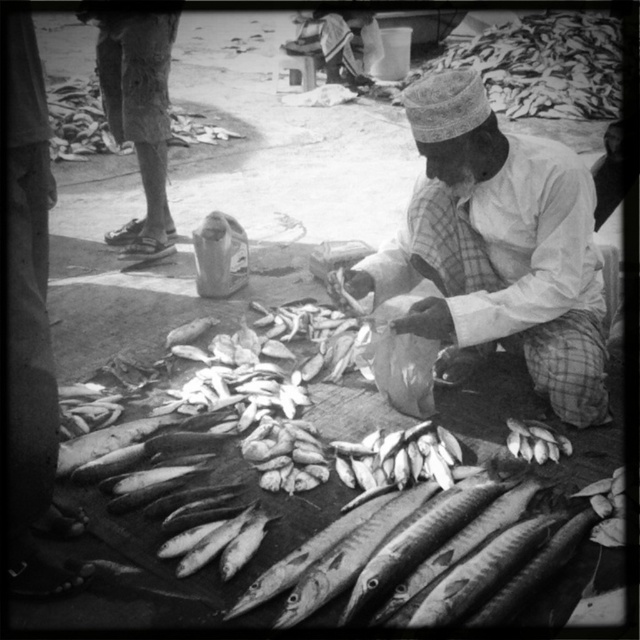
Looking at the fish market scene, which object is bigger between the smooth silver fish at center and the white cotton shirt at center?

The smooth silver fish at center is larger than the white cotton shirt at center according to the description.

You are a customer at the fish market and want to place a small plate between the smooth silver fish at center and the smooth silver fish at lower right. The plate is 10 inches in diameter. Will the plate fit in the space between them?

The distance between the smooth silver fish at center and the smooth silver fish at lower right is 18.28 inches. Since the plate is 10 inches in diameter, it will fit comfortably in the space between them.

You are a customer at the fish market and want to pick up two fish. The first fish is located at point (452,120) and the second fish is at point (554,436). Which fish should you pick up first if you want to collect them in the order they are placed from the nearest to the farthest from you?

You should pick up the fish at point (452,120) first because it is in front of point (554,436), meaning it is closer to you.